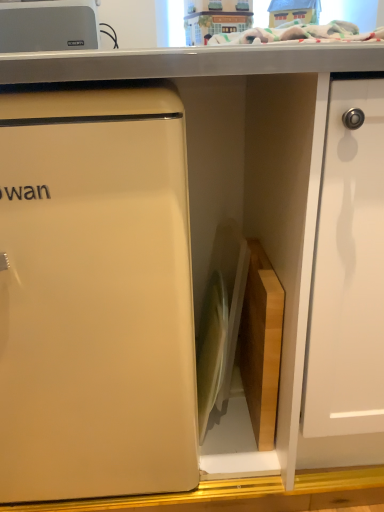
Question: Does white glossy cutting board at center, acting as the first appliance starting from the right, come in front of matte white refrigerator at left?

Choices:
 (A) no
 (B) yes

Answer: (A)

Question: Can you confirm if white glossy cutting board at center, the 2th appliance positioned from the left, is bigger than matte white refrigerator at left?

Choices:
 (A) no
 (B) yes

Answer: (A)

Question: From a real-world perspective, is white glossy cutting board at center, the 2th appliance positioned from the left, on top of matte white refrigerator at left?

Choices:
 (A) yes
 (B) no

Answer: (B)

Question: Considering the relative positions of white glossy cutting board at center, acting as the first appliance starting from the right, and matte white refrigerator at left in the image provided, is white glossy cutting board at center, acting as the first appliance starting from the right, to the left of matte white refrigerator at left from the viewer's perspective?

Choices:
 (A) no
 (B) yes

Answer: (A)

Question: From the image's perspective, would you say white glossy cutting board at center, the 2th appliance positioned from the left, is shown under matte white refrigerator at left?

Choices:
 (A) yes
 (B) no

Answer: (A)

Question: Considering their positions, is matte plastic toy house at upper center located in front of or behind matte white refrigerator at left?

Choices:
 (A) front
 (B) behind

Answer: (B)

Question: From a real-world perspective, is matte plastic toy house at upper center physically located above or below matte white refrigerator at left?

Choices:
 (A) below
 (B) above

Answer: (B)

Question: Considering the positions of point (210, 10) and point (137, 224), is point (210, 10) closer or farther from the camera than point (137, 224)?

Choices:
 (A) closer
 (B) farther

Answer: (B)

Question: Is matte plastic toy house at upper center inside or outside of matte white refrigerator at left?

Choices:
 (A) outside
 (B) inside

Answer: (A)

Question: Is white glossy cutting board at center, the 2th appliance positioned from the top, in front of or behind matte plastic toy house at upper center in the image?

Choices:
 (A) front
 (B) behind

Answer: (A)

Question: Is point (220, 349) positioned closer to the camera than point (183, 5)?

Choices:
 (A) farther
 (B) closer

Answer: (B)

Question: From a real-world perspective, is white glossy cutting board at center, acting as the first appliance starting from the right, positioned above or below matte plastic toy house at upper center?

Choices:
 (A) below
 (B) above

Answer: (A)

Question: Visually, is white glossy cutting board at center, which appears as the first appliance when ordered from the bottom, positioned to the left or to the right of matte plastic toy house at upper center?

Choices:
 (A) left
 (B) right

Answer: (A)

Question: From their relative heights in the image, would you say silver metallic toaster at upper left, which ranks as the first appliance in top-to-bottom order, is taller or shorter than white glossy cutting board at center, which appears as the first appliance when ordered from the bottom?

Choices:
 (A) short
 (B) tall

Answer: (A)

Question: Looking at their shapes, would you say silver metallic toaster at upper left, the 2th appliance positioned from the right, is wider or thinner than white glossy cutting board at center, acting as the first appliance starting from the right?

Choices:
 (A) wide
 (B) thin

Answer: (B)